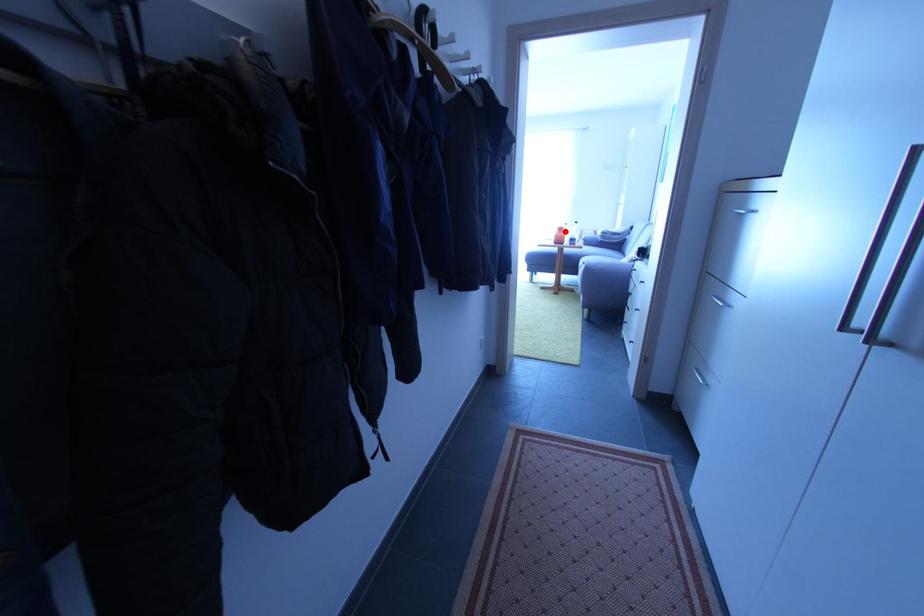
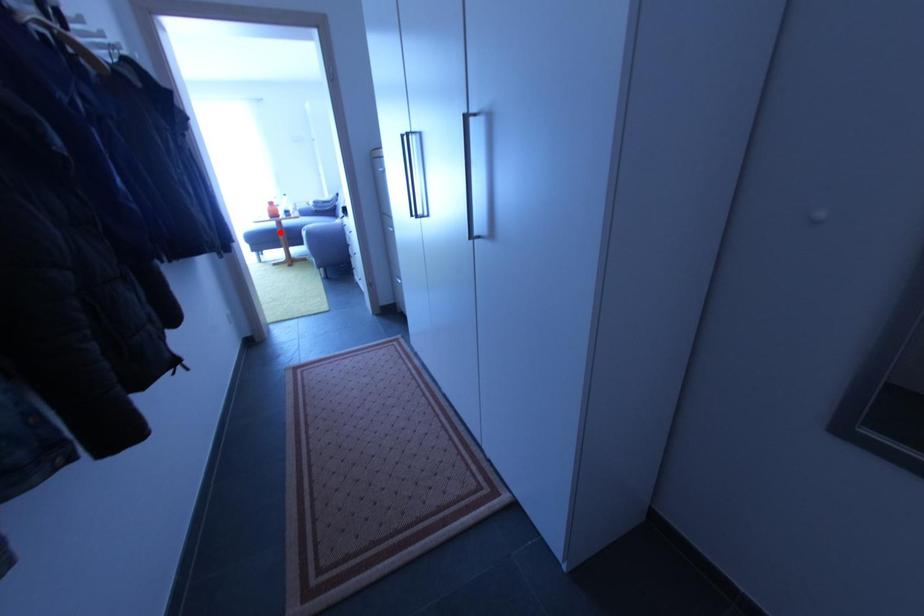
I am providing you with two images of the same scene from different viewpoints. A red point is marked on the first image and another point is marked on the second image. Are the points marked in image1 and image2 representing the same 3D position?

No